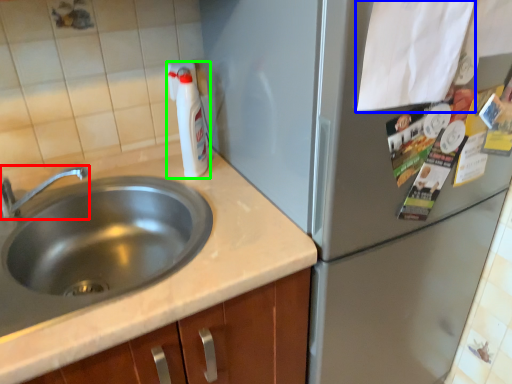
Question: Which is farther away from tap (highlighted by a red box)? paper (highlighted by a blue box) or bottle (highlighted by a green box)?

Choices:
 (A) paper
 (B) bottle

Answer: (A)